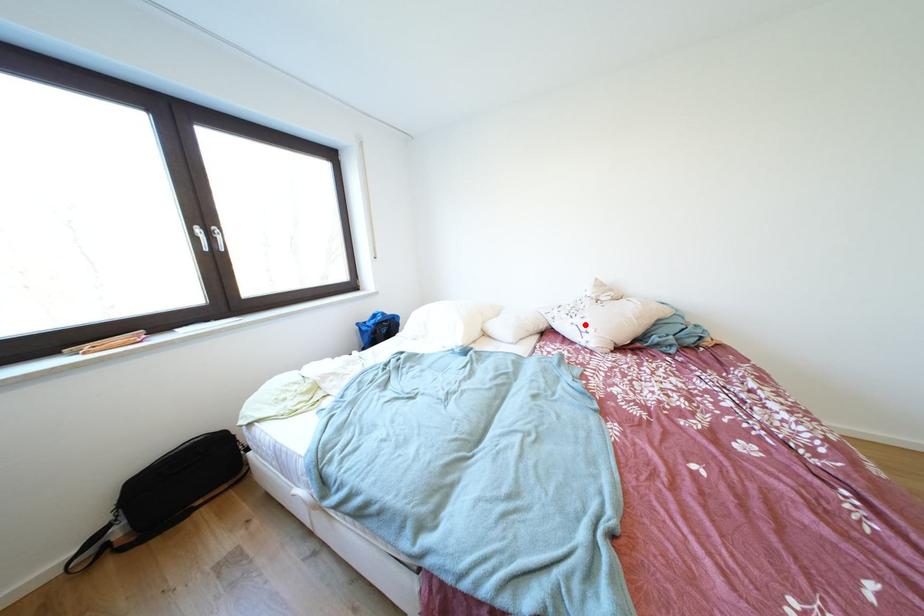
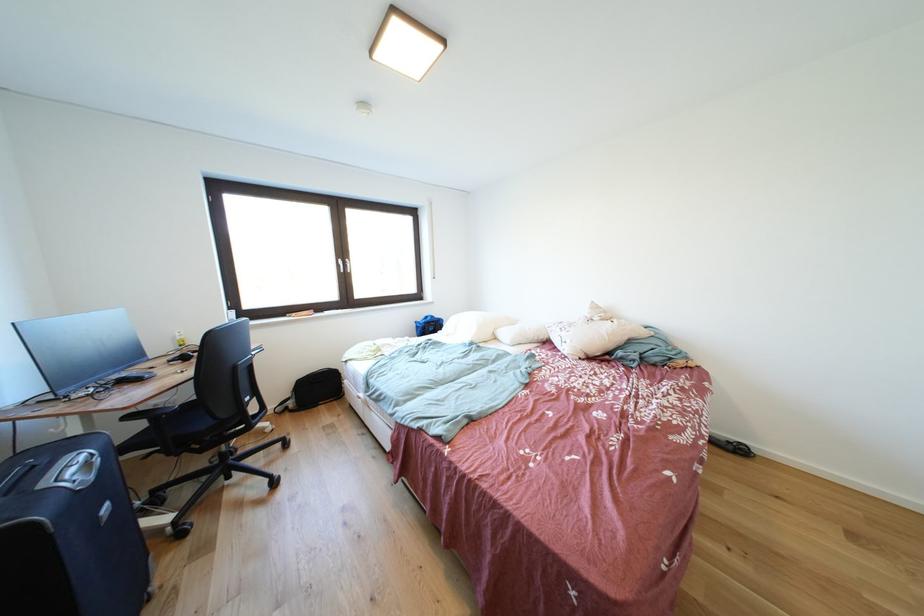
Question: I am providing you with two images of the same scene from different viewpoints. Given a red point in image1, look at the same physical point in image2. Is it:

Choices:
 (A) Closer to the viewpoint
 (B) Farther from the viewpoint

Answer: (A)